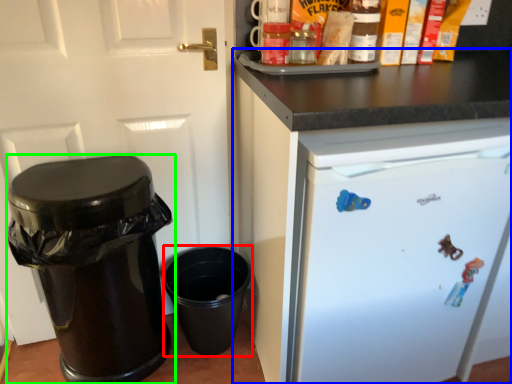
Question: Based on their relative distances, which object is nearer to crock pot (highlighted by a red box)? Choose from cabinetry (highlighted by a blue box) and waste container (highlighted by a green box).

Choices:
 (A) cabinetry
 (B) waste container

Answer: (B)